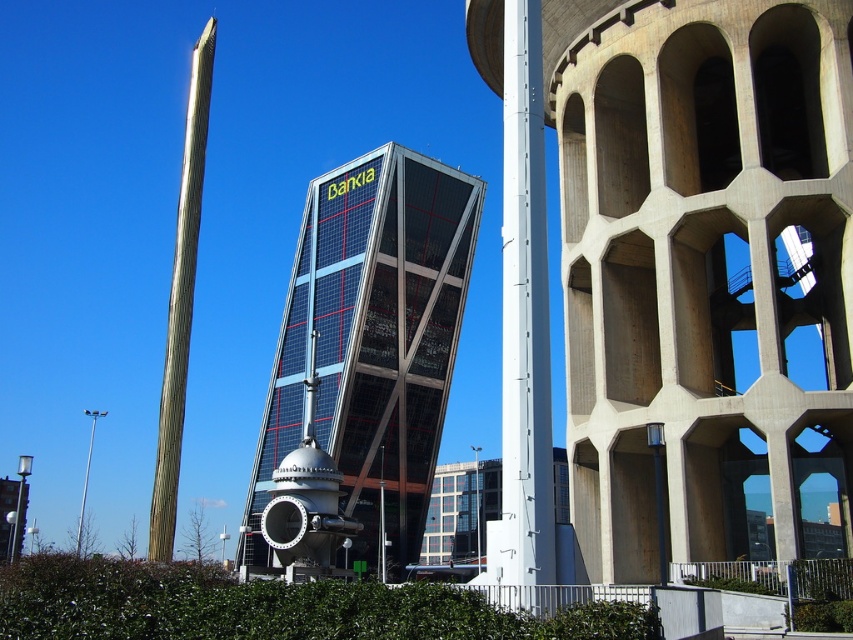
Question: Among these points, which one is nearest to the camera?

Choices:
 (A) (654, 36)
 (B) (314, 180)

Answer: (A)

Question: Estimate the real-world distances between objects in this image. Which object is farther from the concrete at center?

Choices:
 (A) silver metallic pole at left
 (B) polished silver water tower at center

Answer: (A)

Question: Does green leafy hedge at lower center appear on the right side of green textured pole at left?

Choices:
 (A) no
 (B) yes

Answer: (B)

Question: Considering the real-world distances, which object is closest to the green leafy hedge at lower center?

Choices:
 (A) polished silver water tower at center
 (B) green textured pole at left

Answer: (B)

Question: Where is green leafy hedge at lower center located in relation to green textured pole at left in the image?

Choices:
 (A) left
 (B) right

Answer: (B)

Question: Is concrete at center below glassy steel skyscraper at center?

Choices:
 (A) no
 (B) yes

Answer: (A)